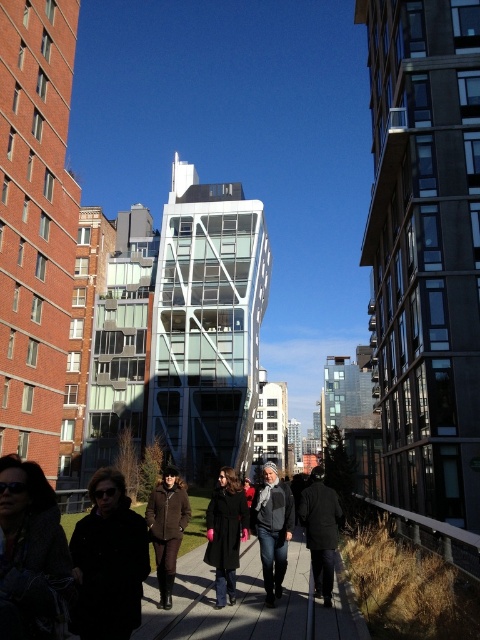
You are a photographer trying to capture both the black wool coat at center and the dark gray wool coat at center in a single frame. Which coat should you position closer to the left side of your camera viewfinder to ensure both are in the shot?

The black wool coat at center is already positioned to the left of the dark gray wool coat at center, so you should keep the black wool coat at center closer to the left side of your camera viewfinder to ensure both coats are captured in the frame.

You are standing at the center of the pathway in the urban scene. You want to find the black wool coat at lower left. Which direction should you look to find it?

→ The black wool coat at lower left is located at point (108, 561), which is to the lower left direction from your current position at the center of the pathway.